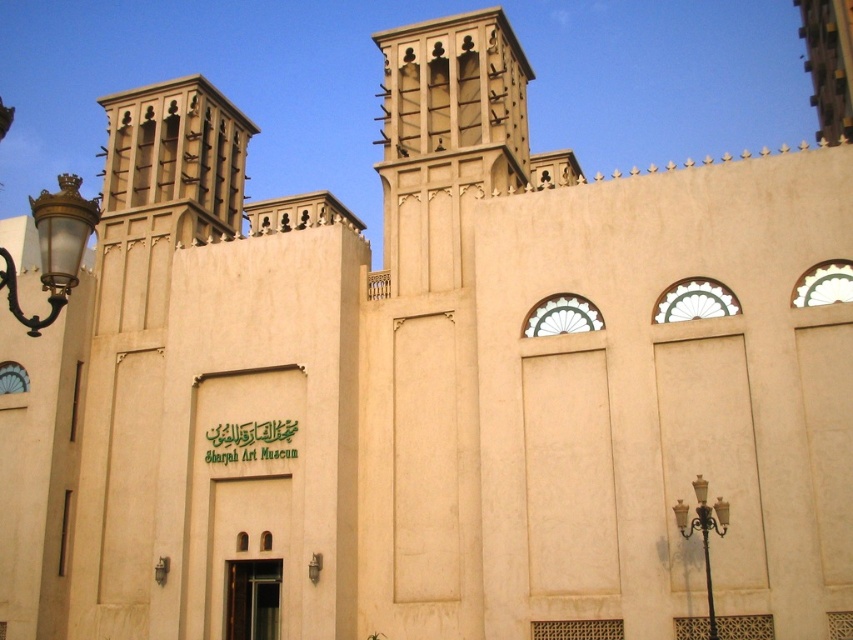
You are an architect visiting the Sharjah Art Museum. You notice the beige stone wind tower at upper center and the matte brass streetlamp at left. Which of these two objects has a smaller width?

The beige stone wind tower at upper center is thinner than the matte brass streetlamp at left, so the beige stone wind tower at upper center has a smaller width.

You are an architect analyzing the Sharjah Art Museum. You notice the beige stone wind tower at upper center and the matte brass streetlamp at left. Which object takes up more area in the image?

The matte brass streetlamp at left takes up more area in the image than the beige stone wind tower at upper center because the beige stone wind tower at upper center occupies less space than matte brass streetlamp at left.

You are standing in front of the Sharjah Art Museum and want to take a photo of the beige stone wind tower at upper center. However, there is a matte brass streetlamp at left in the way. Can you move the streetlamp to the side to get a clear shot of the tower?

The beige stone wind tower at upper center is positioned under the matte brass streetlamp at left, meaning the streetlamp is blocking the view of the tower. To capture the tower clearly, you would need to move the streetlamp out of the way or position yourself so that the lamp is not in front of the tower.